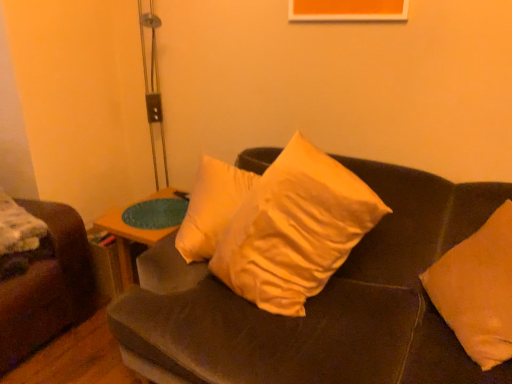
Question: From the image's perspective, does woodenwoodentable at center appear lower than orange fabric pillow at right, positioned as the second pillow in left-to-right order?

Choices:
 (A) no
 (B) yes

Answer: (B)

Question: From the image's perspective, is woodenwoodentable at center on orange fabric pillow at right, positioned as the second pillow in left-to-right order?

Choices:
 (A) yes
 (B) no

Answer: (B)

Question: Does woodenwoodentable at center have a larger size compared to orange fabric pillow at right, positioned as the second pillow in left-to-right order?

Choices:
 (A) yes
 (B) no

Answer: (B)

Question: Can you confirm if woodenwoodentable at center is thinner than orange fabric pillow at right, positioned as the second pillow in left-to-right order?

Choices:
 (A) no
 (B) yes

Answer: (A)

Question: Considering the relative sizes of woodenwoodentable at center and orange fabric pillow at right, which is the 1th pillow from right to left, in the image provided, is woodenwoodentable at center wider than orange fabric pillow at right, which is the 1th pillow from right to left,?

Choices:
 (A) no
 (B) yes

Answer: (B)

Question: Considering the positions of orange fabric pillow at right, which is the 1th pillow from right to left, and woodenwoodentable at center in the image, is orange fabric pillow at right, which is the 1th pillow from right to left, taller or shorter than woodenwoodentable at center?

Choices:
 (A) short
 (B) tall

Answer: (B)

Question: Is orange fabric pillow at right, which is the 1th pillow from right to left, bigger or smaller than woodenwoodentable at center?

Choices:
 (A) big
 (B) small

Answer: (A)

Question: Is orange fabric pillow at right, which is the 1th pillow from right to left, inside or outside of woodenwoodentable at center?

Choices:
 (A) outside
 (B) inside

Answer: (A)

Question: Visually, is orange fabric pillow at right, positioned as the second pillow in left-to-right order, positioned to the left or to the right of woodenwoodentable at center?

Choices:
 (A) left
 (B) right

Answer: (B)

Question: Is point (395, 223) positioned closer to the camera than point (503, 334)?

Choices:
 (A) closer
 (B) farther

Answer: (B)

Question: From the image's perspective, relative to orange fabric pillow at right, which is the 1th pillow from right to left, is velvet brown couch at center above or below?

Choices:
 (A) above
 (B) below

Answer: (B)

Question: Based on their sizes in the image, would you say velvet brown couch at center is bigger or smaller than orange fabric pillow at right, which is the 1th pillow from right to left?

Choices:
 (A) small
 (B) big

Answer: (B)

Question: Do you think velvet brown couch at center is within orange fabric pillow at right, which is the 1th pillow from right to left, or outside of it?

Choices:
 (A) outside
 (B) inside

Answer: (A)

Question: From a real-world perspective, relative to metallic silver table lamp at upper left, is woodenwoodentable at center vertically above or below?

Choices:
 (A) below
 (B) above

Answer: (A)

Question: Is woodenwoodentable at center inside the boundaries of metallic silver table lamp at upper left, or outside?

Choices:
 (A) inside
 (B) outside

Answer: (B)